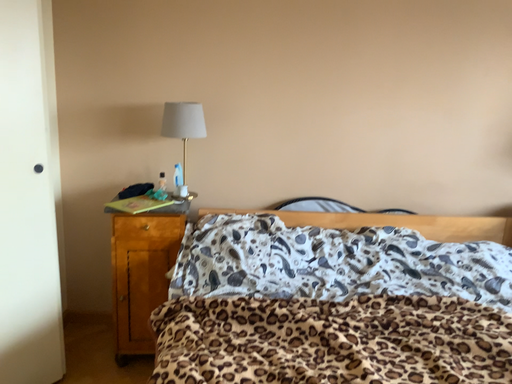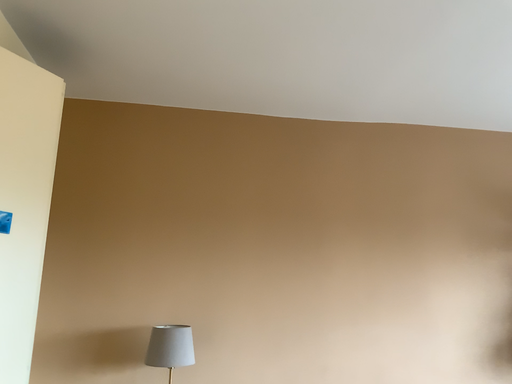
Question: How did the camera likely rotate when shooting the video?

Choices:
 (A) rotated right
 (B) rotated left

Answer: (A)